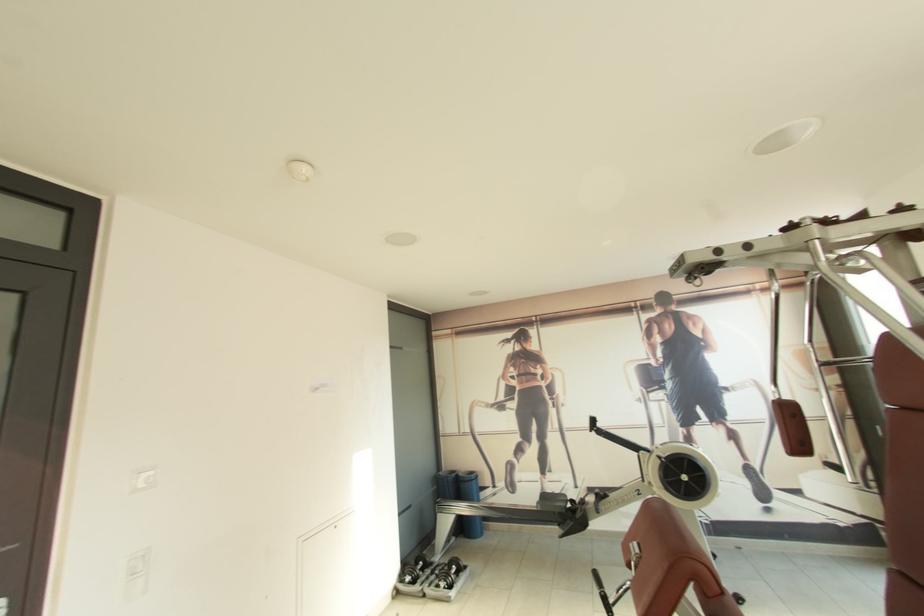
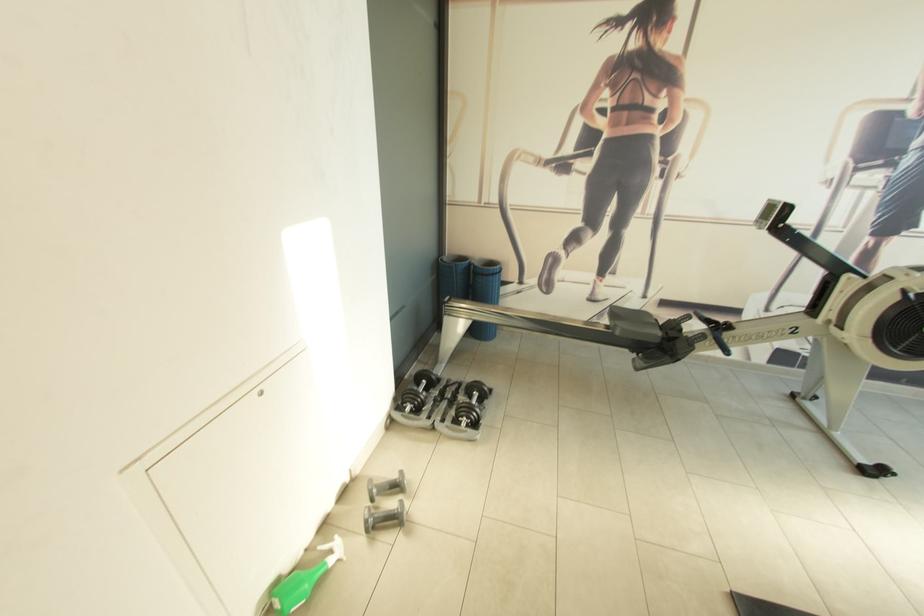
The point at (419, 575) is marked in the first image. Where is the corresponding point in the second image?

(424, 402)